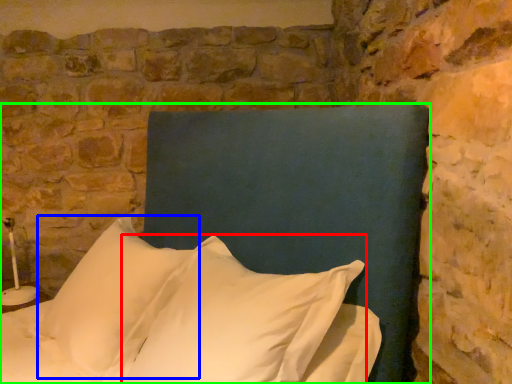
Question: Which object is positioned farthest from pillow (highlighted by a red box)? Select from pillow (highlighted by a blue box) and bed (highlighted by a green box).

Choices:
 (A) pillow
 (B) bed

Answer: (A)